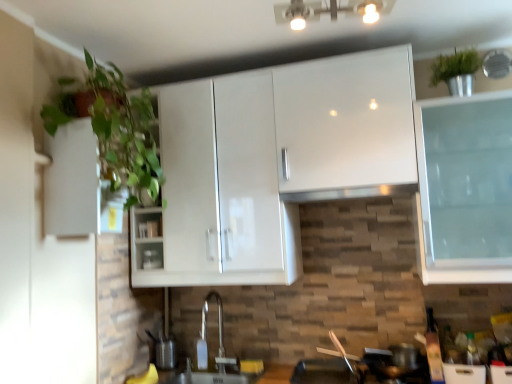
Question: Can you confirm if metallic silver toaster at center is shorter than satin silver exhaust hood at center?

Choices:
 (A) no
 (B) yes

Answer: (A)

Question: From the image's perspective, is metallic silver toaster at center located above satin silver exhaust hood at center?

Choices:
 (A) yes
 (B) no

Answer: (B)

Question: Can you confirm if metallic silver toaster at center is smaller than satin silver exhaust hood at center?

Choices:
 (A) yes
 (B) no

Answer: (A)

Question: Considering the relative sizes of metallic silver toaster at center and satin silver exhaust hood at center in the image provided, is metallic silver toaster at center bigger than satin silver exhaust hood at center?

Choices:
 (A) no
 (B) yes

Answer: (A)

Question: Is metallic silver toaster at center turned away from satin silver exhaust hood at center?

Choices:
 (A) yes
 (B) no

Answer: (B)

Question: From the image's perspective, is metallic silver toaster at center beneath satin silver exhaust hood at center?

Choices:
 (A) yes
 (B) no

Answer: (A)

Question: Does metallic silver toaster at center have a smaller size compared to white glossy cabinet at left?

Choices:
 (A) no
 (B) yes

Answer: (B)

Question: Is metallic silver toaster at center to the right of white glossy cabinet at left from the viewer's perspective?

Choices:
 (A) no
 (B) yes

Answer: (B)

Question: Are metallic silver toaster at center and white glossy cabinet at left far apart?

Choices:
 (A) yes
 (B) no

Answer: (B)

Question: Is metallic silver toaster at center located outside white glossy cabinet at left?

Choices:
 (A) no
 (B) yes

Answer: (B)

Question: Can you confirm if metallic silver toaster at center is taller than white glossy cabinet at left?

Choices:
 (A) no
 (B) yes

Answer: (A)

Question: Is metallic silver toaster at center wider than white glossy cabinet at left?

Choices:
 (A) yes
 (B) no

Answer: (B)

Question: Are green leafy plant at left and white glossy cabinet at left far apart?

Choices:
 (A) no
 (B) yes

Answer: (A)